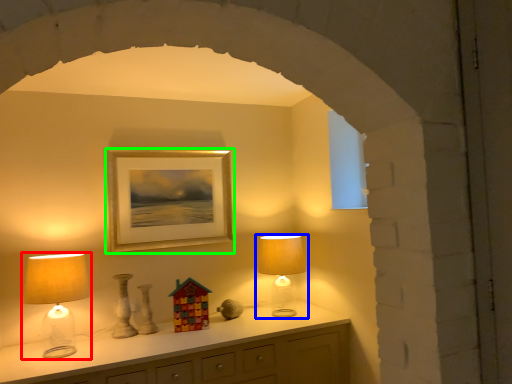
Question: Which object is positioned farthest from lamp (highlighted by a red box)? Select from lamp (highlighted by a blue box) and picture frame (highlighted by a green box).

Choices:
 (A) lamp
 (B) picture frame

Answer: (A)